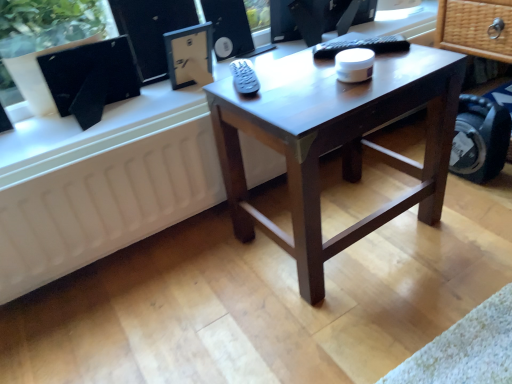
Find the location of a particular element. The width and height of the screenshot is (512, 384). free space that is to the left of black matte computer monitor at upper left is located at coordinates (35, 135).